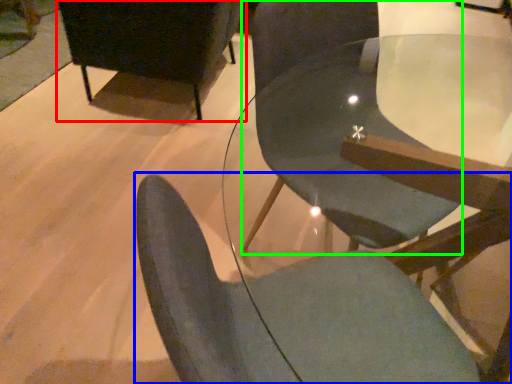
Question: Which is nearer to the chair (highlighted by a red box)? chair (highlighted by a blue box) or chair (highlighted by a green box).

Choices:
 (A) chair
 (B) chair

Answer: (B)